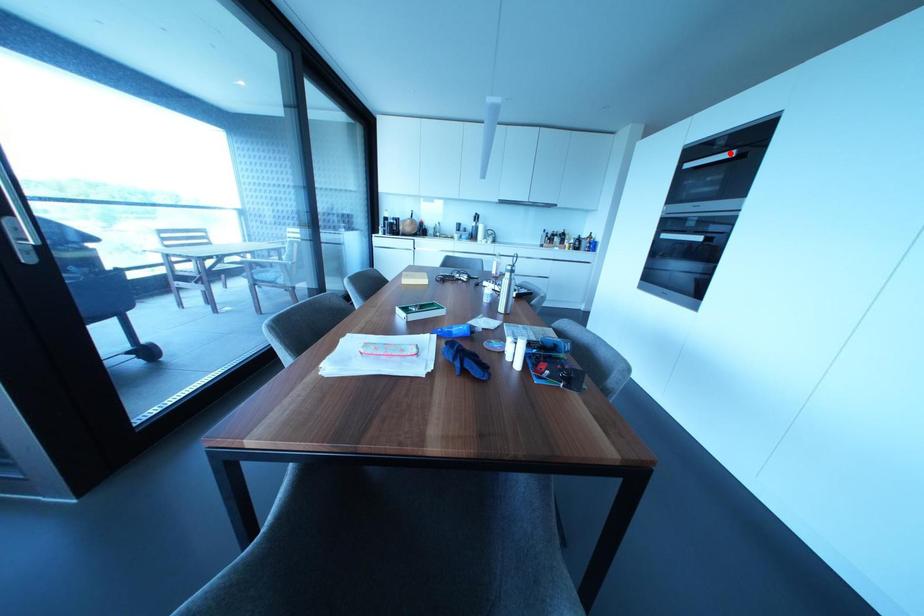
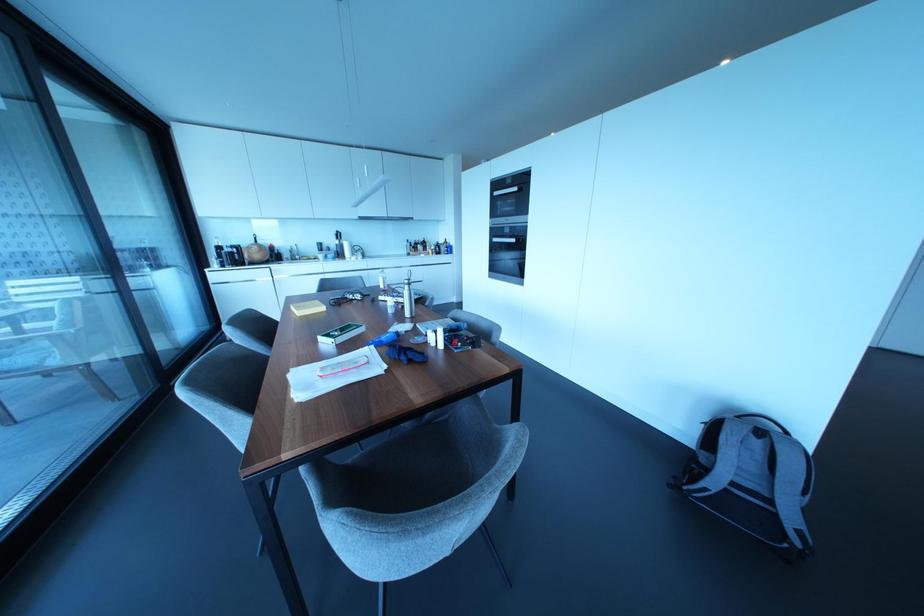
Where in the second image is the point corresponding to the highlighted location from the first image?

(515, 188)